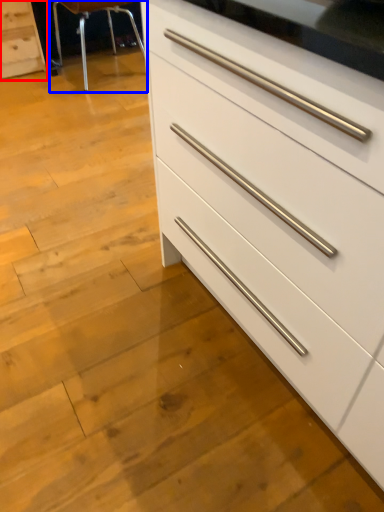
Question: Which object is further to the camera taking this photo, chest of drawers (highlighted by a red box) or bar stool (highlighted by a blue box)?

Choices:
 (A) chest of drawers
 (B) bar stool

Answer: (A)